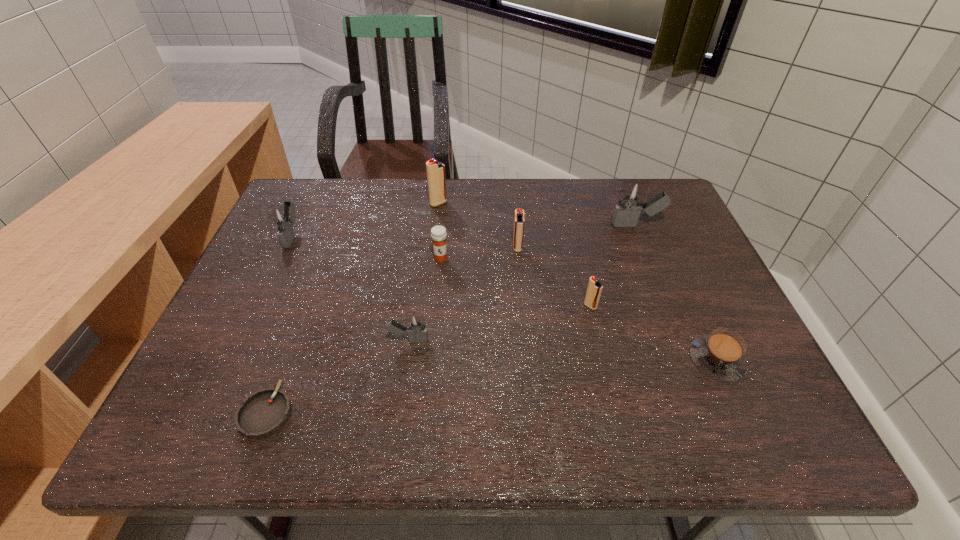
At what (x,y) coordinates should I click in order to perform the action: click on the nearest red igniter. Please return your answer as a coordinate pair (x, y). Looking at the image, I should click on (594, 289).

At what (x,y) coordinates should I click in order to perform the action: click on the smallest gray igniter. Please return your answer as a coordinate pair (x, y). The image size is (960, 540). Looking at the image, I should click on (416, 329).

This screenshot has height=540, width=960. In order to click on the nearest igniter in this screenshot , I will do `click(416, 329)`.

At what (x,y) coordinates should I click in order to perform the action: click on the eighth tallest object. Please return your answer as a coordinate pair (x, y). Looking at the image, I should click on (721, 355).

The height and width of the screenshot is (540, 960). Identify the location of cappuccino. tap(721, 355).

In order to click on the shortest object in this screenshot , I will do `click(263, 413)`.

What are the coordinates of `the nearest object` in the screenshot? It's located at click(x=263, y=413).

Locate an element on the screen. The height and width of the screenshot is (540, 960). free space located on the front of the farthest red igniter is located at coordinates (428, 290).

At what (x,y) coordinates should I click in order to perform the action: click on vacant space situated on the left of the rightmost gray igniter. Please return your answer as a coordinate pair (x, y). Image resolution: width=960 pixels, height=540 pixels. Looking at the image, I should click on (514, 225).

At what (x,y) coordinates should I click in order to perform the action: click on vacant space located on the right of the leftmost gray igniter. Please return your answer as a coordinate pair (x, y). Looking at the image, I should click on (x=400, y=235).